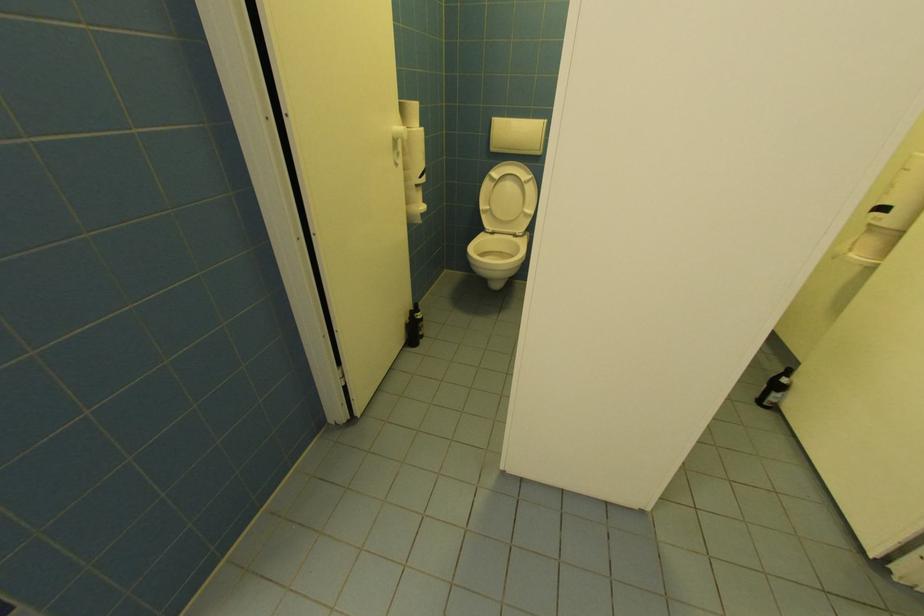
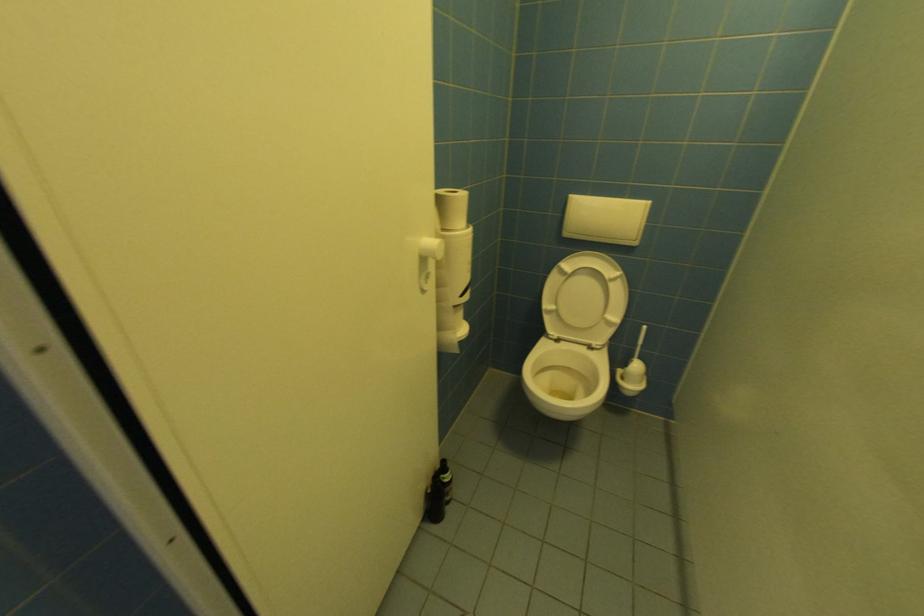
Question: Which direction would the cameraman need to move to produce the second image? Reply with the corresponding letter.

Choices:
 (A) Left
 (B) Right
 (C) Forward
 (D) Backward

Answer: (C)